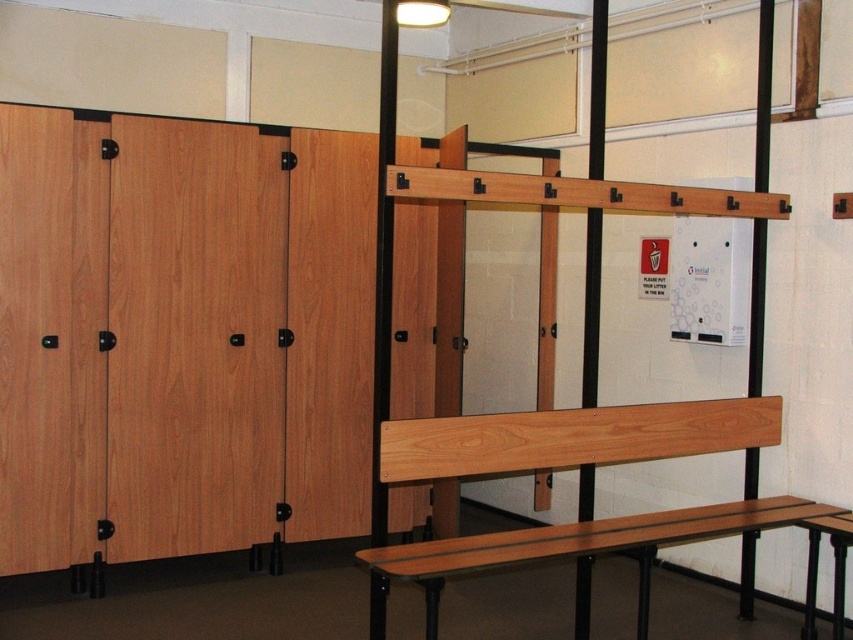
You are standing in the restroom area and want to sit down. Which bench should you approach first, the natural wood bench at center or the wooden bench at center?

You should approach the natural wood bench at center first because it is closer to you than the wooden bench at center.

You are trying to sit on the bench in the center of the restroom. There are two benches labeled as natural wood bench at center and wooden bench at center. Which one is wider?

The natural wood bench at center is wider than the wooden bench at center according to the description.